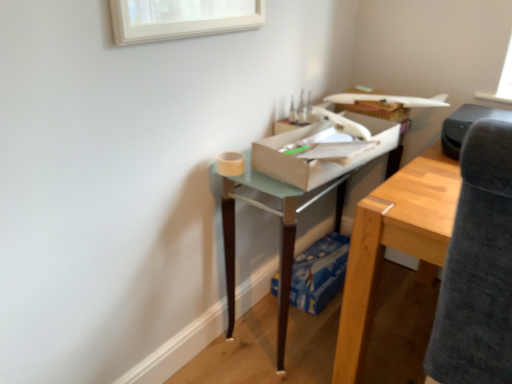
From the picture: What is the approximate width of blue cardboard box at lower center, the 1th cardboard box positioned from the back?

It is 9.94 inches.

Identify the location of translucent glass table at center. The image size is (512, 384). (296, 195).

Who is smaller, dark gray fabric swivel chair at right or blue cardboard box at lower center, which is the second cardboard box in top-to-bottom order?

blue cardboard box at lower center, which is the second cardboard box in top-to-bottom order, is smaller.

Is point (473, 221) closer to viewer compared to point (300, 283)?

Yes, it is.

Looking at this image, is dark gray fabric swivel chair at right in front of or behind blue cardboard box at lower center, which is the second cardboard box in top-to-bottom order, in the image?

Clearly, dark gray fabric swivel chair at right is in front of blue cardboard box at lower center, which is the second cardboard box in top-to-bottom order.

Considering the sizes of objects dark gray fabric swivel chair at right and blue cardboard box at lower center, which is the second cardboard box in top-to-bottom order, in the image provided, who is thinner, dark gray fabric swivel chair at right or blue cardboard box at lower center, which is the second cardboard box in top-to-bottom order,?

blue cardboard box at lower center, which is the second cardboard box in top-to-bottom order, is thinner.

Is point (321, 258) positioned before point (446, 351)?

No, it is behind (446, 351).

Could you measure the distance between blue cardboard box at lower center, which is the second cardboard box in top-to-bottom order, and dark gray fabric swivel chair at right?

The distance of blue cardboard box at lower center, which is the second cardboard box in top-to-bottom order, from dark gray fabric swivel chair at right is 98.25 centimeters.

Considering the sizes of blue cardboard box at lower center, the first cardboard box when ordered from bottom to top, and dark gray fabric swivel chair at right in the image, is blue cardboard box at lower center, the first cardboard box when ordered from bottom to top, wider or thinner than dark gray fabric swivel chair at right?

Considering their sizes, blue cardboard box at lower center, the first cardboard box when ordered from bottom to top, looks slimmer than dark gray fabric swivel chair at right.

Can you confirm if blue cardboard box at lower center, which is the second cardboard box in top-to-bottom order, is bigger than dark gray fabric swivel chair at right?

No, blue cardboard box at lower center, which is the second cardboard box in top-to-bottom order, is not bigger than dark gray fabric swivel chair at right.

Between translucent glass table at center and white cardboard box at center, acting as the 1th cardboard box starting from the front, which one has more height?

translucent glass table at center is taller.

Measure the distance between translucent glass table at center and white cardboard box at center, which appears as the first cardboard box when viewed from the top.

translucent glass table at center is 4.20 inches from white cardboard box at center, which appears as the first cardboard box when viewed from the top.

Is translucent glass table at center positioned with its back to white cardboard box at center, which is the 2th cardboard box from back to front?

No, translucent glass table at center is not facing the opposite direction of white cardboard box at center, which is the 2th cardboard box from back to front.

Is translucent glass table at center not inside white cardboard box at center, which appears as the first cardboard box when viewed from the top?

translucent glass table at center is positioned outside white cardboard box at center, which appears as the first cardboard box when viewed from the top.

Does black plastic printer at upper right have a smaller size compared to white cardboard box at center, the 2th cardboard box ordered from the bottom?

Indeed, black plastic printer at upper right has a smaller size compared to white cardboard box at center, the 2th cardboard box ordered from the bottom.

Which of these two, black plastic printer at upper right or white cardboard box at center, which appears as the first cardboard box when viewed from the top, stands shorter?

Standing shorter between the two is white cardboard box at center, which appears as the first cardboard box when viewed from the top.

Locate an element on the screen. The image size is (512, 384). printer that is above the white cardboard box at center, acting as the 1th cardboard box starting from the front (from a real-world perspective) is located at coordinates (466, 125).

Is point (511, 286) positioned after point (452, 116)?

No.

From the picture: Considering the relative sizes of dark gray fabric swivel chair at right and black plastic printer at upper right in the image provided, is dark gray fabric swivel chair at right thinner than black plastic printer at upper right?

Incorrect, the width of dark gray fabric swivel chair at right is not less than that of black plastic printer at upper right.

Would you say black plastic printer at upper right is part of dark gray fabric swivel chair at right's contents?

That's incorrect, black plastic printer at upper right is not inside dark gray fabric swivel chair at right.

Looking at this image, between black plastic printer at upper right and translucent glass table at center, which one appears on the left side from the viewer's perspective?

From the viewer's perspective, translucent glass table at center appears more on the left side.

Between black plastic printer at upper right and translucent glass table at center, which one has less height?

With less height is black plastic printer at upper right.

Which is in front, dark gray fabric swivel chair at right or white cardboard box at center, acting as the 1th cardboard box starting from the front?

dark gray fabric swivel chair at right is closer to the camera.

In order to click on swivel chair that is below the white cardboard box at center, the 2th cardboard box ordered from the bottom (from the image's perspective) in this screenshot , I will do `click(478, 267)`.

Is dark gray fabric swivel chair at right not within white cardboard box at center, acting as the 1th cardboard box starting from the front?

Yes, dark gray fabric swivel chair at right is outside of white cardboard box at center, acting as the 1th cardboard box starting from the front.

Is dark gray fabric swivel chair at right looking in the opposite direction of white cardboard box at center, which is the 2th cardboard box from back to front?

No.

I want to click on swivel chair that appears above the blue cardboard box at lower center, which ranks as the 2th cardboard box in front-to-back order (from the image's perspective), so click(x=478, y=267).

What are the coordinates of `cardboard box below the dark gray fabric swivel chair at right (from the image's perspective)` in the screenshot? It's located at (319, 273).

Which object lies further to the anchor point translucent glass table at center, black plastic printer at upper right or blue cardboard box at lower center, which ranks as the 2th cardboard box in front-to-back order?

black plastic printer at upper right is further to translucent glass table at center.

From the image, which object appears to be farther from black plastic printer at upper right, dark gray fabric swivel chair at right or white cardboard box at center, the 2th cardboard box ordered from the bottom?

The object further to black plastic printer at upper right is dark gray fabric swivel chair at right.

Considering their positions, is dark gray fabric swivel chair at right positioned closer to white cardboard box at center, acting as the 1th cardboard box starting from the front, than translucent glass table at center?

translucent glass table at center.

Which object lies further to the anchor point black plastic printer at upper right, dark gray fabric swivel chair at right or blue cardboard box at lower center, which ranks as the 2th cardboard box in front-to-back order?

blue cardboard box at lower center, which ranks as the 2th cardboard box in front-to-back order, lies further to black plastic printer at upper right than the other object.

Based on their spatial positions, is dark gray fabric swivel chair at right or translucent glass table at center further from blue cardboard box at lower center, which ranks as the 2th cardboard box in front-to-back order?

Based on the image, dark gray fabric swivel chair at right appears to be further to blue cardboard box at lower center, which ranks as the 2th cardboard box in front-to-back order.

Which object lies nearer to the anchor point dark gray fabric swivel chair at right, white cardboard box at center, the 2th cardboard box ordered from the bottom, or black plastic printer at upper right?

white cardboard box at center, the 2th cardboard box ordered from the bottom, lies closer to dark gray fabric swivel chair at right than the other object.

Which object lies nearer to the anchor point dark gray fabric swivel chair at right, blue cardboard box at lower center, the first cardboard box when ordered from bottom to top, or white cardboard box at center, which appears as the first cardboard box when viewed from the top?

Among the two, white cardboard box at center, which appears as the first cardboard box when viewed from the top, is located nearer to dark gray fabric swivel chair at right.

Looking at the image, which one is located further to white cardboard box at center, which is the 2th cardboard box from back to front, blue cardboard box at lower center, which is the second cardboard box in top-to-bottom order, or black plastic printer at upper right?

blue cardboard box at lower center, which is the second cardboard box in top-to-bottom order, lies further to white cardboard box at center, which is the 2th cardboard box from back to front, than the other object.

Find the location of a particular element. The image size is (512, 384). table between dark gray fabric swivel chair at right and blue cardboard box at lower center, the first cardboard box when ordered from bottom to top, from front to back is located at coordinates (296, 195).

This screenshot has height=384, width=512. In order to click on table positioned between dark gray fabric swivel chair at right and black plastic printer at upper right from near to far in this screenshot , I will do `click(296, 195)`.

This screenshot has width=512, height=384. What are the coordinates of `printer between translucent glass table at center and blue cardboard box at lower center, the 1th cardboard box positioned from the back, in the front-back direction` in the screenshot? It's located at (466, 125).

Find the location of a particular element. Image resolution: width=512 pixels, height=384 pixels. cardboard box between black plastic printer at upper right and blue cardboard box at lower center, the first cardboard box when ordered from bottom to top, in the up-down direction is located at coordinates (319, 160).